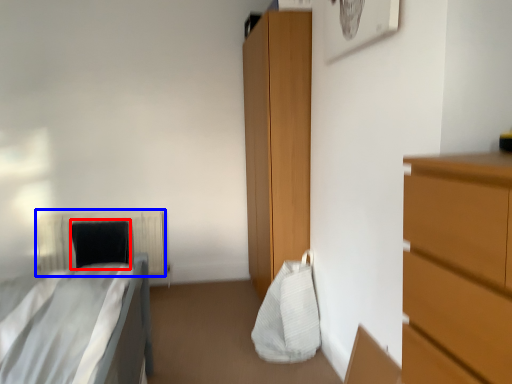
Question: Among these objects, which one is farthest to the camera, pillow (highlighted by a red box) or radiator (highlighted by a blue box)?

Choices:
 (A) pillow
 (B) radiator

Answer: (B)